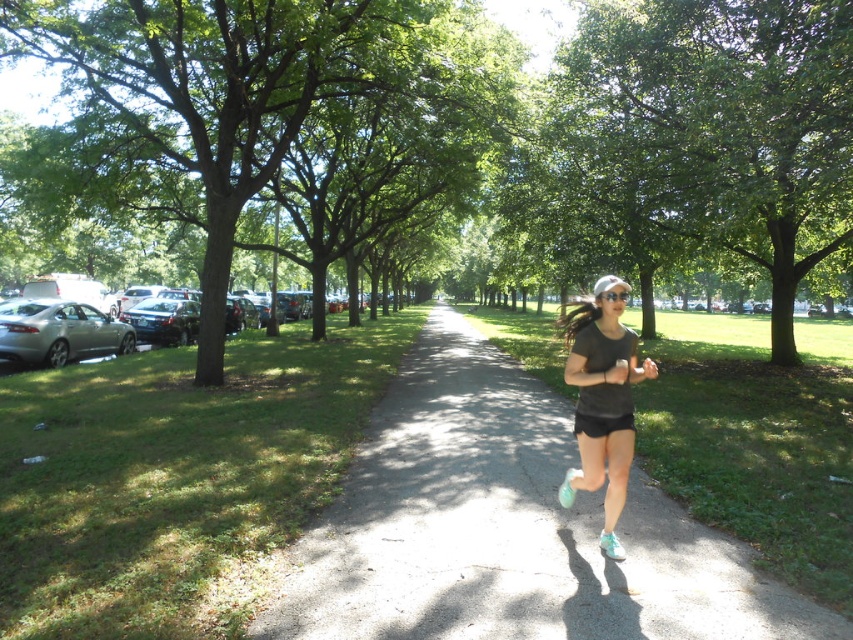
You are standing at the edge of the matte gray asphalt path at center and see the white matte running shoe at center ahead. Which object is closer to you?

The matte gray asphalt path at center is closer to the viewer than the white matte running shoe at center.